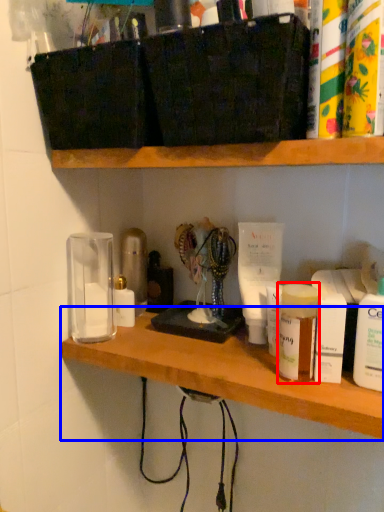
Question: Which object appears farthest to the camera in this image, toiletry (highlighted by a red box) or shelf (highlighted by a blue box)?

Choices:
 (A) toiletry
 (B) shelf

Answer: (A)